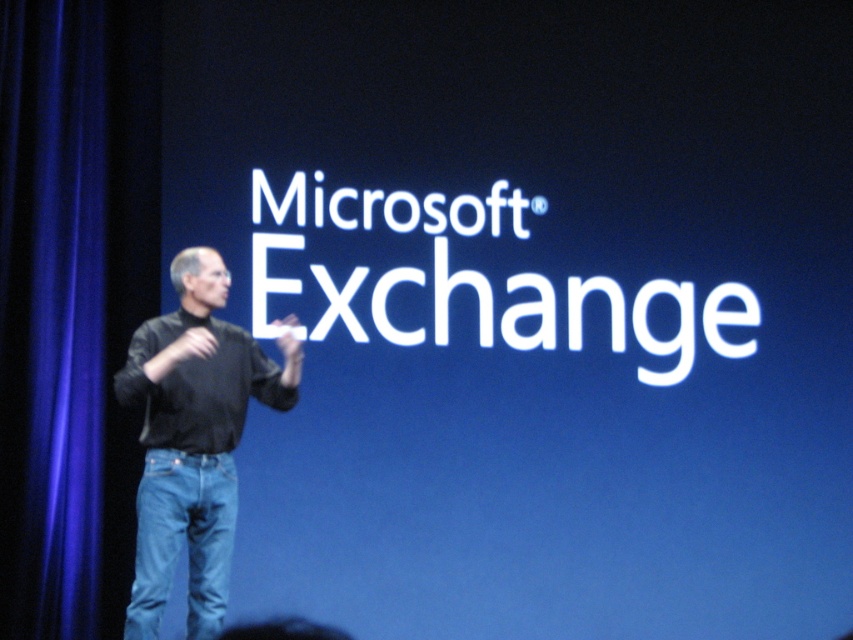
Measure the distance between blue velvet curtain at left and camera.

A distance of 19.20 meters exists between blue velvet curtain at left and camera.

Which is in front, point (44, 536) or point (138, 506)?

Point (138, 506) is more forward.

Who is more distant from viewer, (18, 278) or (225, 564)?

The point (18, 278) is behind.

Where is `blue velvet curtain at left`? The width and height of the screenshot is (853, 640). blue velvet curtain at left is located at coordinates click(x=51, y=314).